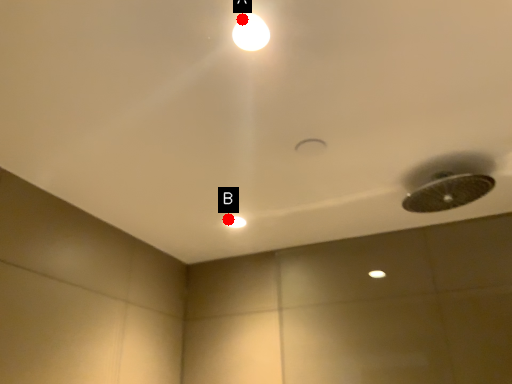
Question: Two points are circled on the image, labeled by A and B beside each circle. Among these points, which one is farthest from the camera?

Choices:
 (A) A is further
 (B) B is further

Answer: (B)